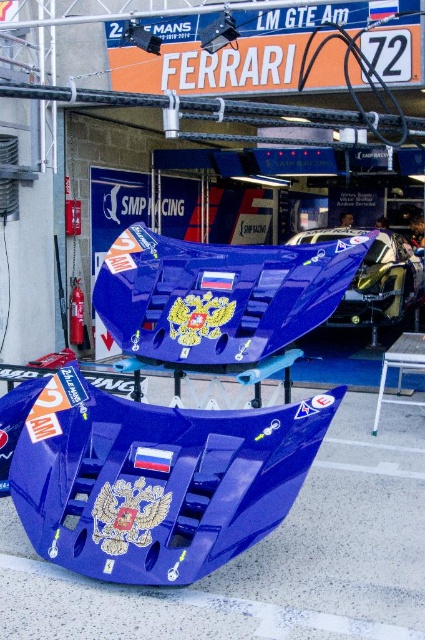
You are a race engineer inspecting the Ferrari race car in the garage. You notice two points marked on the car body at coordinates point (25,397) and point (362,289). From your position in front of the car, which point is closer to you?

Point (25,397) is in front of point (362,289), so the point closer to you is point (25,397).

From the picture: You are a mechanic inspecting the Ferrari race car in the garage. You notice the glossy blue spoiler at center and the glossy blue car at center. Which object is located to the left of the other?

The glossy blue spoiler at center is positioned on the left side of the glossy blue car at center.

You are a mechanic working on the Ferrari race car. You need to access the engine compartment located at the front of the glossy blue car at center. However, the glossy blue spoiler at center is blocking your way. Can you lift the spoiler to gain access, or is there another part you should adjust first?

The glossy blue spoiler at center is positioned under the glossy blue car at center, so lifting the spoiler would not obstruct the engine compartment. You should check if there is another part above the car blocking access, but according to the description, the spoiler is underneath. Therefore, you can safely lift the glossy blue spoiler at center to access the engine compartment.